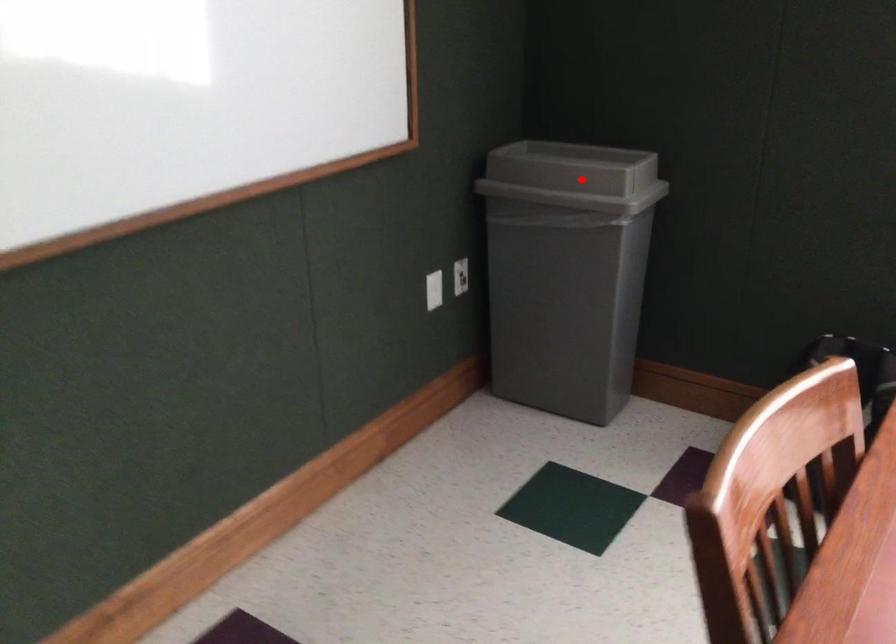
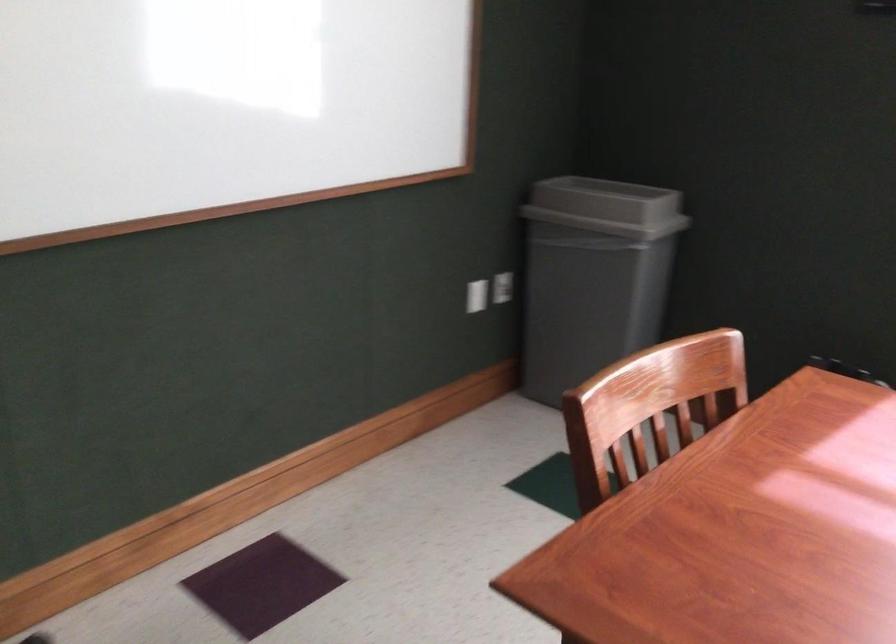
Find the pixel in the second image that matches the highlighted location in the first image.

(607, 207)